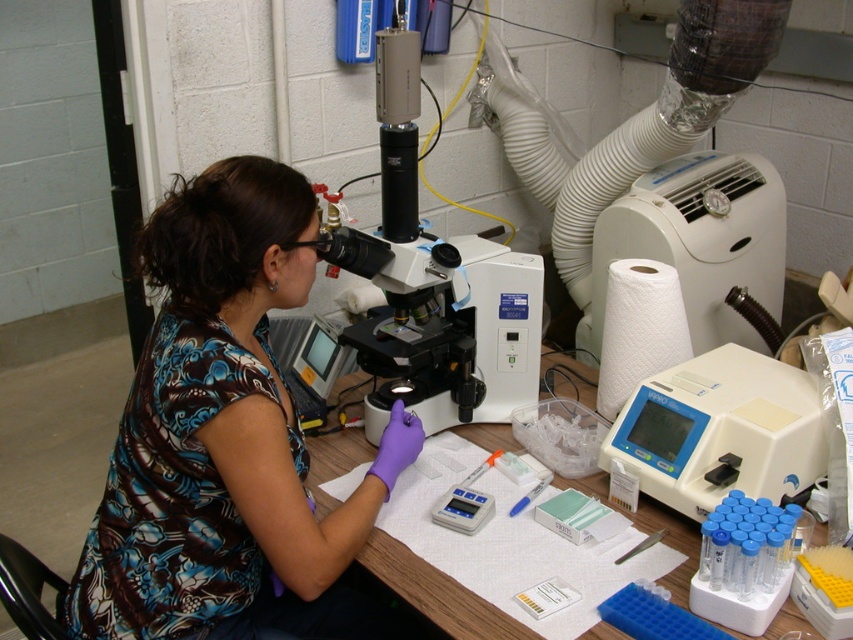
What do you see at coordinates (434, 282) in the screenshot?
I see `white plastic microscope at center` at bounding box center [434, 282].

Who is more forward, (437, 262) or (788, 432)?

Point (788, 432)

At what (x,y) coordinates should I click in order to perform the action: click on white plastic microscope at center. Please return your answer as a coordinate pair (x, y). The image size is (853, 640). Looking at the image, I should click on (434, 282).

The height and width of the screenshot is (640, 853). I want to click on white plastic microscope at center, so click(x=434, y=282).

You are a GUI agent. You are given a task and a screenshot of the screen. Output one action in this format:
    pyautogui.click(x=<x>, y=<y>)
    Task: Click on the white plastic microscope at center
    The image size is (853, 640).
    Given the screenshot: What is the action you would take?
    tap(434, 282)

Looking at this image, who is more distant from viewer, (463, 250) or (457, 477)?

Positioned behind is point (463, 250).

Where is `white plastic microscope at center`? white plastic microscope at center is located at coordinates tap(434, 282).

Between wooden table at center and blue plastic pen at center, which one has less height?

blue plastic pen at center

Is point (392, 588) farther from viewer compared to point (527, 493)?

No, (392, 588) is in front of (527, 493).

Locate an element on the screen. Image resolution: width=853 pixels, height=640 pixels. wooden table at center is located at coordinates (456, 554).

What are the coordinates of `wooden table at center` in the screenshot? It's located at (456, 554).